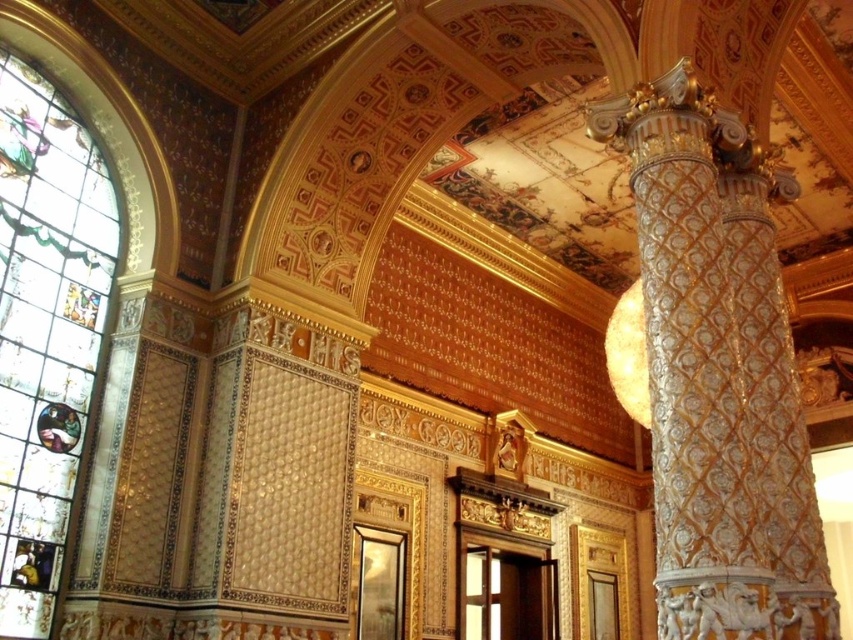
Between white textured column at right and stained glass at left, which one is positioned lower?

Positioned lower is white textured column at right.

Who is more forward, [804,429] or [36,550]?

Point [804,429] is more forward.

Is point (761, 580) positioned in front of point (44, 529)?

Yes, point (761, 580) is in front of point (44, 529).

Locate an element on the screen. The height and width of the screenshot is (640, 853). white textured column at right is located at coordinates (718, 372).